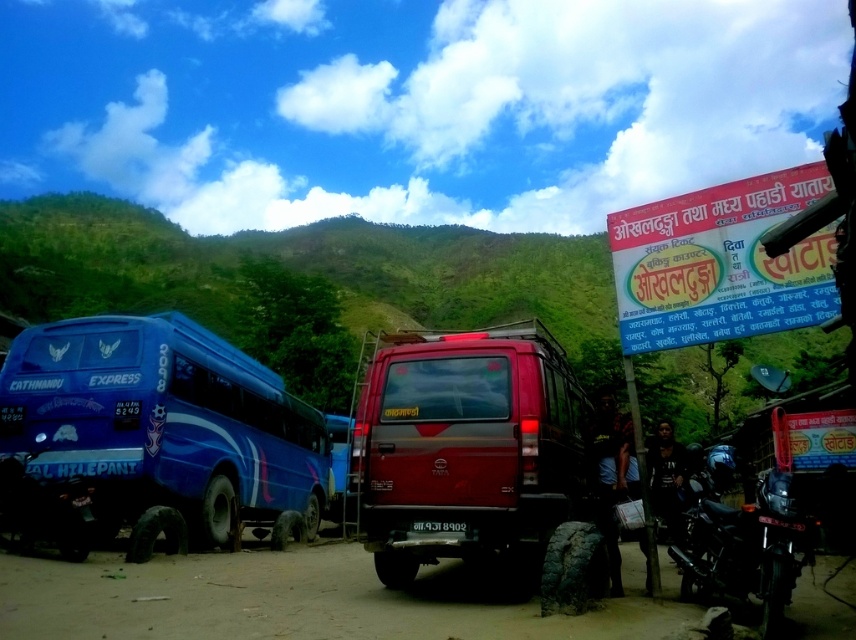
You are a delivery driver who needs to park your 14.5 inch wide delivery van between the shiny red van at center and the black plastic license plate at center. Is there enough space for your van to fit between them?

The shiny red van at center is 14.36 inches from the black plastic license plate at center. Since your van is 14.5 inches wide, it is slightly wider than the available space, so it won not fit between them.

You are a traveler standing on the dirt road between the shiny red van at center and the blue glossy bus at left. You want to take a photo of both vehicles in the same frame. Which vehicle should you position closer to when taking the photo?

The shiny red van at center is located above the blue glossy bus at left, so to capture both in the same frame, you should position yourself closer to the blue glossy bus at left to include the van above it in the shot.